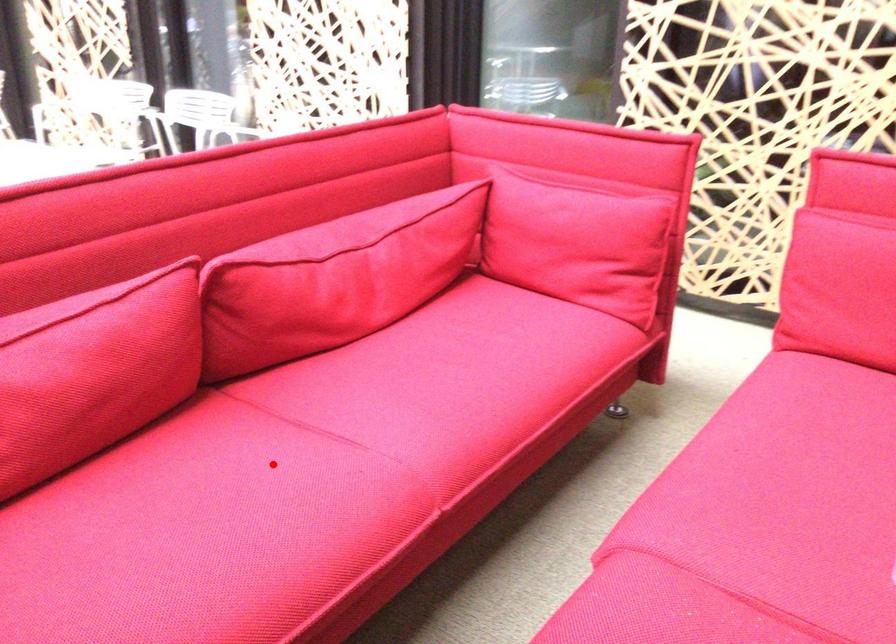
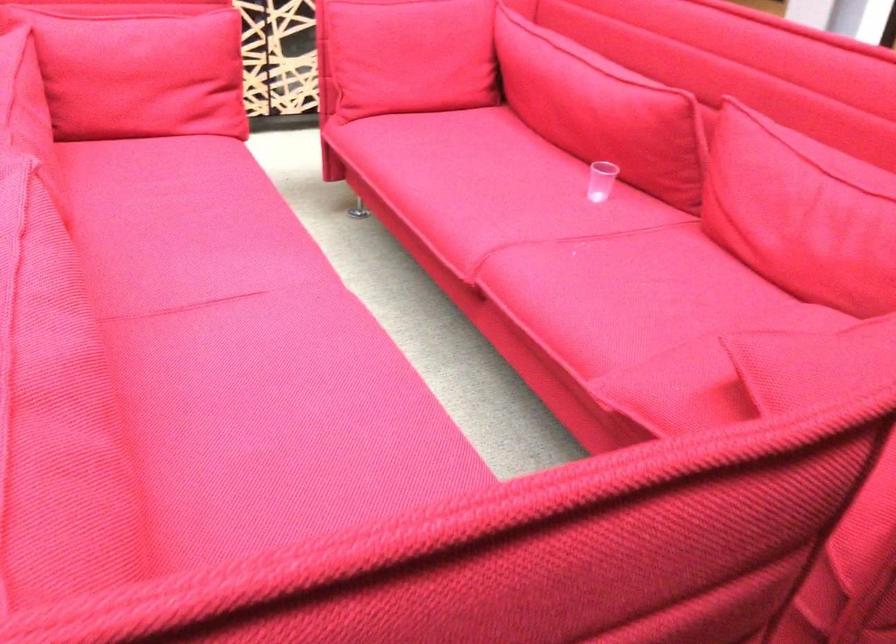
Locate, in the second image, the point that corresponds to the highlighted location in the first image.

(243, 337)